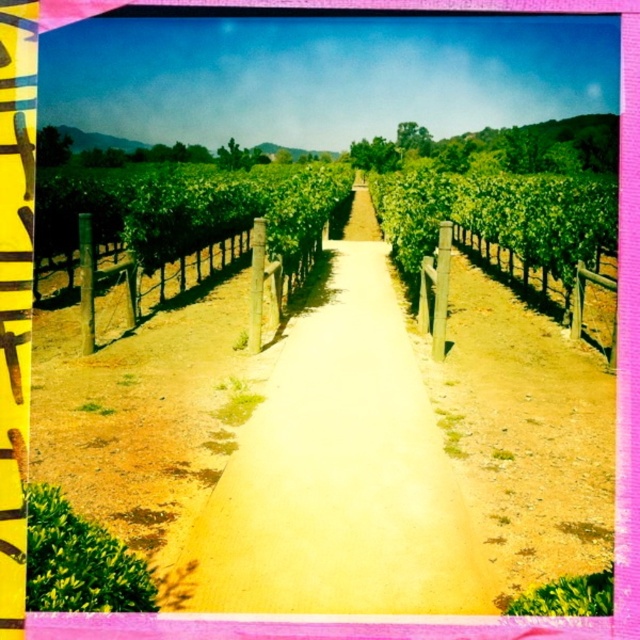
Is wooden post fence at left wider than wooden post at center?

Correct, the width of wooden post fence at left exceeds that of wooden post at center.

Can you confirm if wooden post fence at left is shorter than wooden post at center?

Indeed, wooden post fence at left has a lesser height compared to wooden post at center.

Is point (154, 289) closer to viewer compared to point (600, 326)?

No, (154, 289) is behind (600, 326).

The width and height of the screenshot is (640, 640). Find the location of `wooden post fence at left`. wooden post fence at left is located at coordinates [x=186, y=276].

Which of these two, dirt path at center or wooden post at center, stands taller?

wooden post at center

Can you confirm if dirt path at center is thinner than wooden post at center?

Correct, dirt path at center's width is less than wooden post at center's.

Identify the location of dirt path at center. (340, 470).

Can you confirm if dirt path at center is smaller than wooden post fence at left?

Yes.

Does point (332, 387) lie in front of point (99, 282)?

Yes, point (332, 387) is in front of point (99, 282).

Where is `dirt path at center`? The image size is (640, 640). dirt path at center is located at coordinates (340, 470).